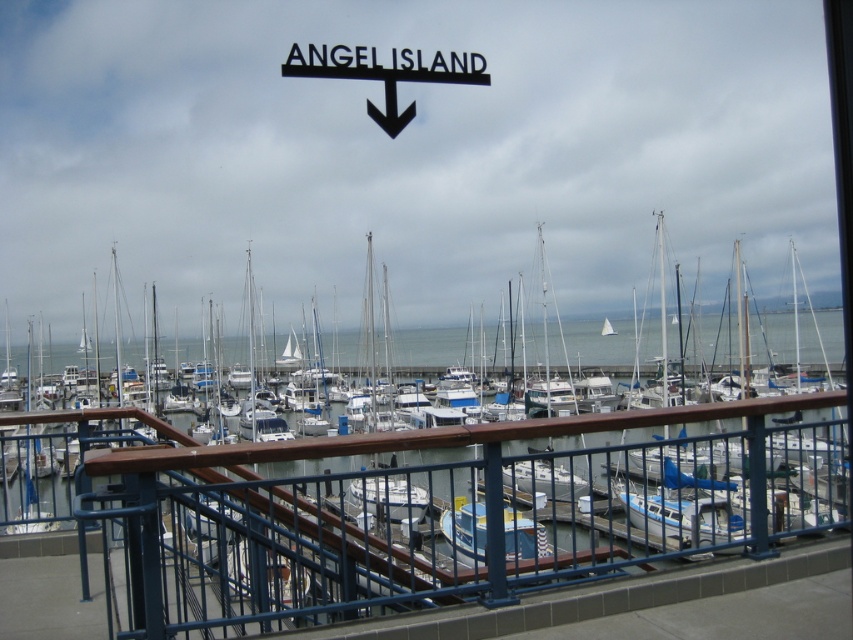
Is point (561, 577) positioned before point (345, 493)?

Yes, it is in front of point (345, 493).

Does white matte sailboat at center have a smaller size compared to blue metal railing at center?

No.

Locate an element on the screen. The image size is (853, 640). white matte sailboat at center is located at coordinates (424, 492).

This screenshot has width=853, height=640. Identify the location of blue metal railing at center. (453, 516).

Is blue metal railing at center taller than black metal sign at upper center?

Yes.

Is point (604, 428) in front of point (387, 77)?

Yes, point (604, 428) is closer to viewer.

At what (x,y) coordinates should I click in order to perform the action: click on blue metal railing at center. Please return your answer as a coordinate pair (x, y). Looking at the image, I should click on (453, 516).

Between point (408, 556) and point (341, 52), which one is positioned behind?

The point (408, 556) is more distant.

In the scene shown: Who is more distant from viewer, (695, 541) or (422, 77)?

The point (695, 541) is behind.

Where is `white matte sailboat at center`? white matte sailboat at center is located at coordinates (424, 492).